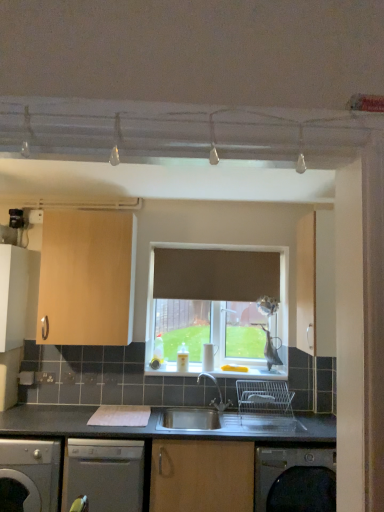
Question: Considering the relative sizes of white glossy window sill at center and light wood cabinet at upper left, which is the 2th cabinetry in right-to-left order, in the image provided, is white glossy window sill at center taller than light wood cabinet at upper left, which is the 2th cabinetry in right-to-left order,?

Choices:
 (A) no
 (B) yes

Answer: (A)

Question: Is white glossy window sill at center bigger than light wood cabinet at upper left, which appears as the second cabinetry when viewed from the left?

Choices:
 (A) yes
 (B) no

Answer: (B)

Question: Is white glossy window sill at center not within light wood cabinet at upper left, which is the 2th cabinetry in right-to-left order?

Choices:
 (A) no
 (B) yes

Answer: (B)

Question: Is white glossy window sill at center turned away from light wood cabinet at upper left, which appears as the second cabinetry when viewed from the left?

Choices:
 (A) no
 (B) yes

Answer: (A)

Question: Can you confirm if white glossy window sill at center is positioned to the left of light wood cabinet at upper left, which appears as the second cabinetry when viewed from the left?

Choices:
 (A) yes
 (B) no

Answer: (B)

Question: From a real-world perspective, is white glossy window sill at center on top of light wood cabinet at upper left, which is the 2th cabinetry in right-to-left order?

Choices:
 (A) yes
 (B) no

Answer: (B)

Question: From a real-world perspective, is satin silver dishwasher at lower center, acting as the first dishwasher starting from the right, positioned over stainless steel sink at center based on gravity?

Choices:
 (A) no
 (B) yes

Answer: (A)

Question: Can you confirm if satin silver dishwasher at lower center, the second dishwasher viewed from the left, is positioned to the right of stainless steel sink at center?

Choices:
 (A) yes
 (B) no

Answer: (B)

Question: Does satin silver dishwasher at lower center, the second dishwasher viewed from the left, turn towards stainless steel sink at center?

Choices:
 (A) yes
 (B) no

Answer: (B)

Question: Considering the relative sizes of satin silver dishwasher at lower center, the second dishwasher viewed from the left, and stainless steel sink at center in the image provided, is satin silver dishwasher at lower center, the second dishwasher viewed from the left, bigger than stainless steel sink at center?

Choices:
 (A) no
 (B) yes

Answer: (B)

Question: Does satin silver dishwasher at lower center, acting as the first dishwasher starting from the right, have a lesser height compared to stainless steel sink at center?

Choices:
 (A) yes
 (B) no

Answer: (B)

Question: From the image's perspective, does satin silver dishwasher at lower center, acting as the first dishwasher starting from the right, appear lower than stainless steel sink at center?

Choices:
 (A) no
 (B) yes

Answer: (B)

Question: Does matte wood cabinet at right, arranged as the third cabinetry when viewed from the left, have a greater width compared to light wood cabinet at upper left, which appears as the second cabinetry when viewed from the left?

Choices:
 (A) no
 (B) yes

Answer: (B)